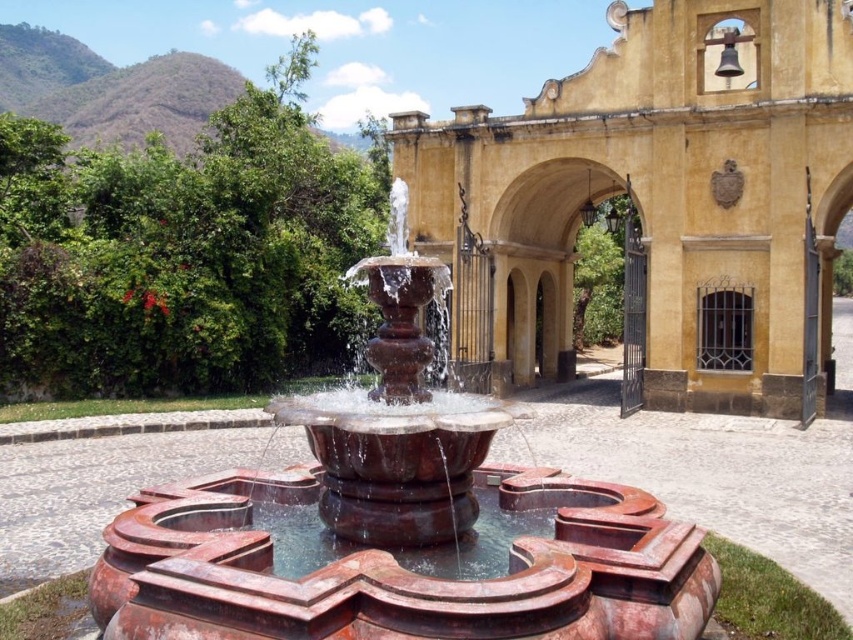
Who is positioned more to the left, matte yellow stone church at center or rustic terracotta fountain at center?

rustic terracotta fountain at center is more to the left.

The height and width of the screenshot is (640, 853). What do you see at coordinates (665, 196) in the screenshot?
I see `matte yellow stone church at center` at bounding box center [665, 196].

Is point (505, 138) closer to viewer compared to point (265, 410)?

No.

Find the location of a particular element. This screenshot has width=853, height=640. matte yellow stone church at center is located at coordinates (665, 196).